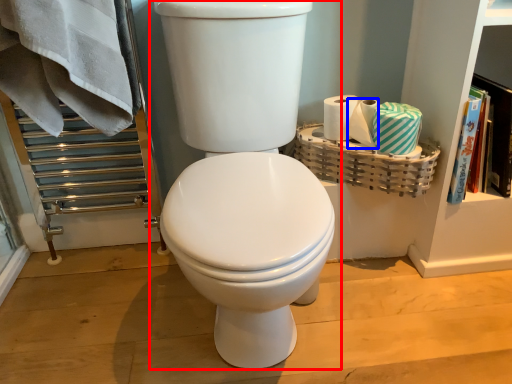
Question: Among these objects, which one is farthest to the camera, toilet (highlighted by a red box) or toilet paper (highlighted by a blue box)?

Choices:
 (A) toilet
 (B) toilet paper

Answer: (B)